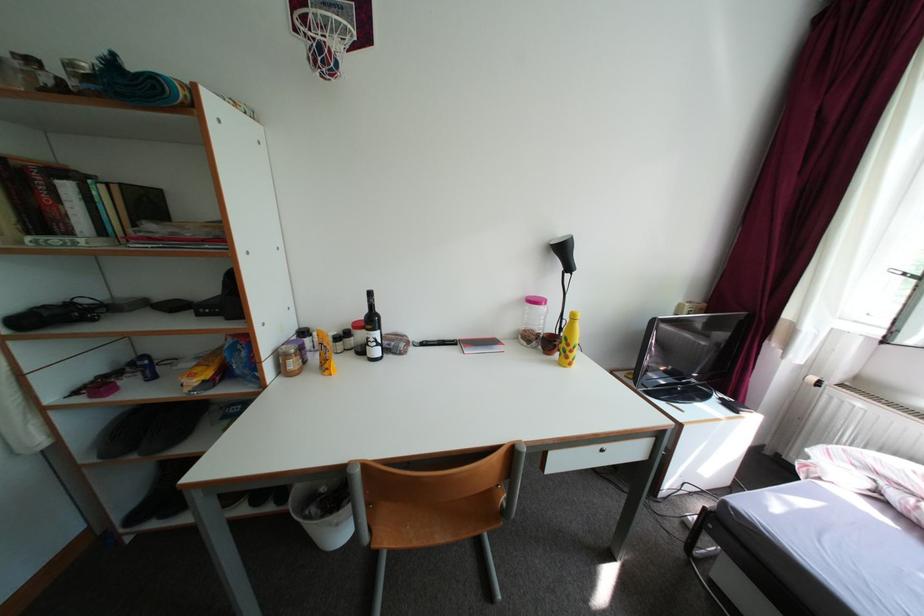
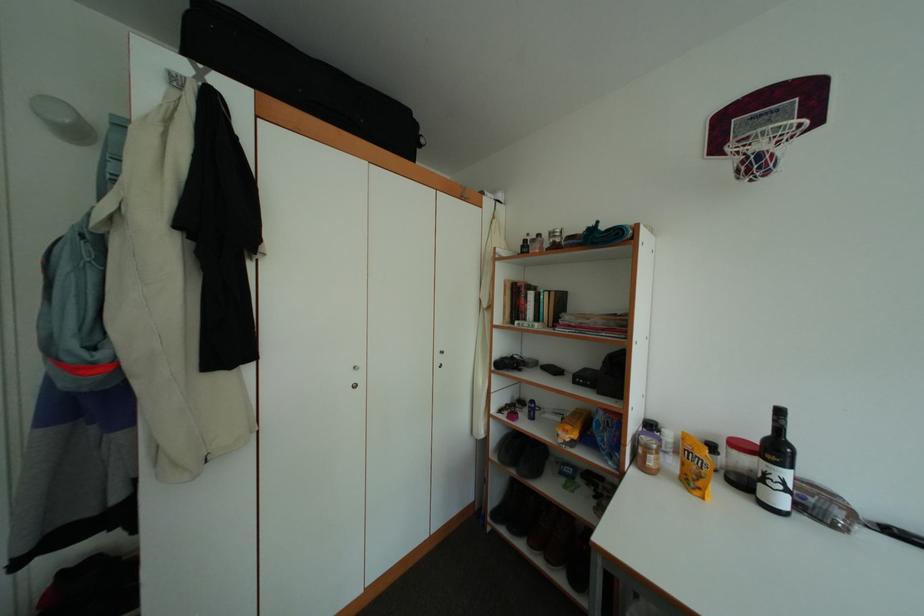
Question: The images are taken continuously from a first-person perspective. In which direction is your viewpoint rotating?

Choices:
 (A) Left
 (B) Right
 (C) Up
 (D) Down

Answer: (A)